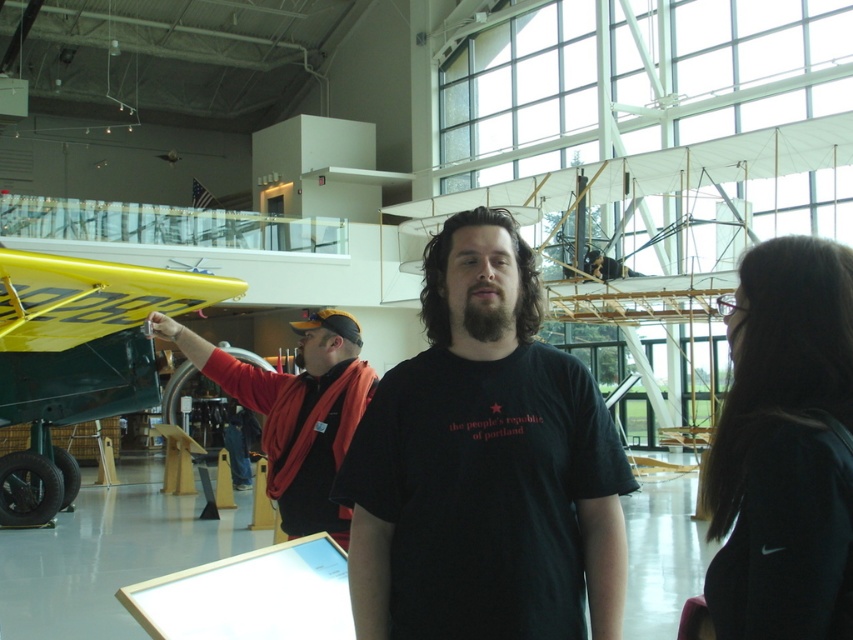
You are an interior designer planning to place a new sculpture in this museum. The sculpture is 1.2 meters wide. You have two options for placement locations based on existing items. The first option is next to the yellow matte airplane at left, and the second is next to the orange fabric jacket at center. Which location would allow the sculpture to fit better without exceeding the width of the existing item?

The yellow matte airplane at left has a greater width than the orange fabric jacket at center. Since the sculpture is 1.2 meters wide, placing it next to the yellow matte airplane at left would provide more space and ensure it doesn not exceed the existing item width.